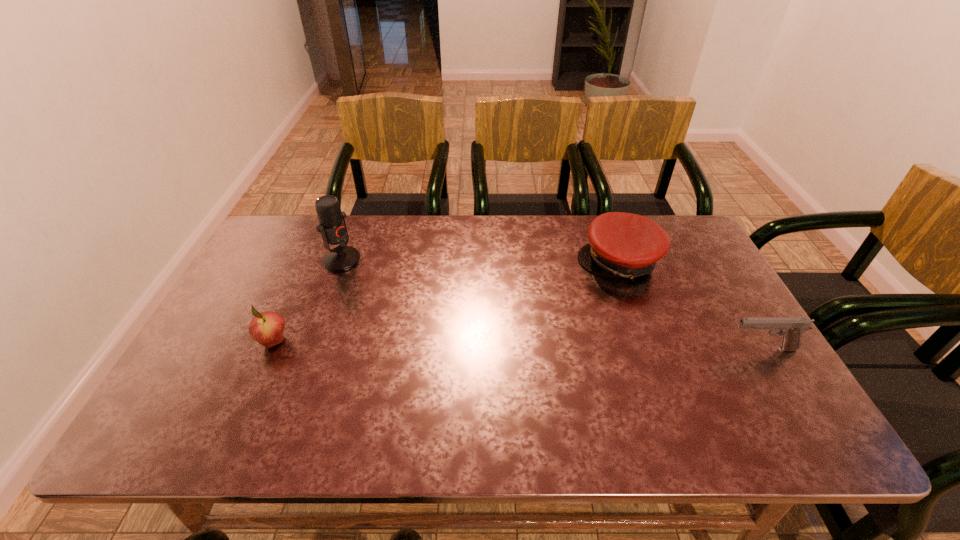
At what (x,y) coordinates should I click in order to perform the action: click on vacant space on the desktop that is between the leftmost object and the pistol and is positioned at the front of the cap where the visor is located. Please return your answer as a coordinate pair (x, y). Image resolution: width=960 pixels, height=540 pixels. Looking at the image, I should click on (504, 345).

What are the coordinates of `free space on the desktop that is between the leftmost object and the rightmost object and is positioned on the side of the third object from right to left with the red ring` in the screenshot? It's located at (498, 345).